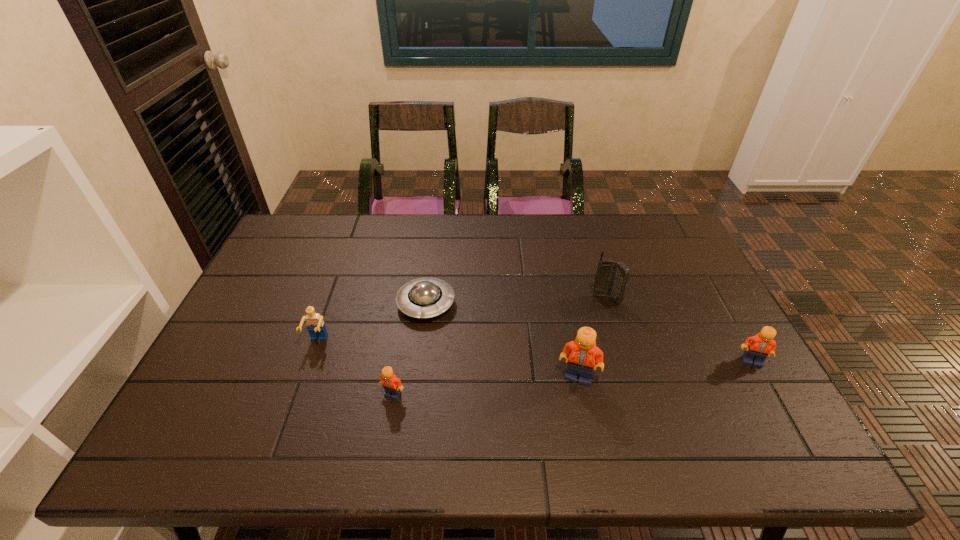
The image size is (960, 540). I want to click on vacant position located on the face of the fourth nearest object, so click(x=294, y=411).

The width and height of the screenshot is (960, 540). Identify the location of vacant space located on the back of the saucer. click(430, 269).

The image size is (960, 540). Find the location of `object that is at the right edge`. object that is at the right edge is located at coordinates (758, 347).

Where is `vacant area at the far edge`? vacant area at the far edge is located at coordinates (598, 238).

In the image, there is a desktop. Find the location of `free space at the near edge`. free space at the near edge is located at coordinates (404, 401).

Locate an element on the screen. This screenshot has height=540, width=960. blank space at the left edge is located at coordinates (258, 334).

The image size is (960, 540). I want to click on free space at the right edge of the desktop, so click(x=680, y=327).

The width and height of the screenshot is (960, 540). I want to click on free space at the near left corner, so click(x=180, y=408).

Identify the location of vacant space at the near right corner of the desktop. (740, 388).

Image resolution: width=960 pixels, height=540 pixels. What are the coordinates of `vacant point located between the saucer and the fourth object from left to right` in the screenshot? It's located at (502, 340).